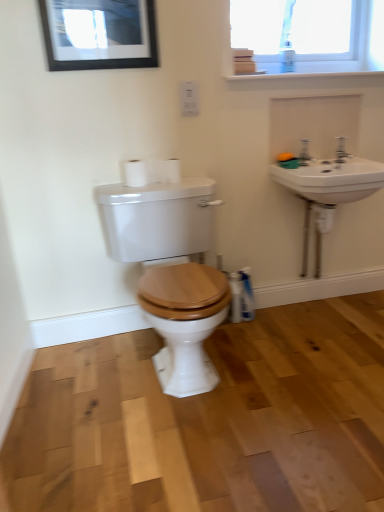
Locate an element on the screen. The image size is (384, 512). free space in front of white plastic bottle at lower right is located at coordinates (255, 336).